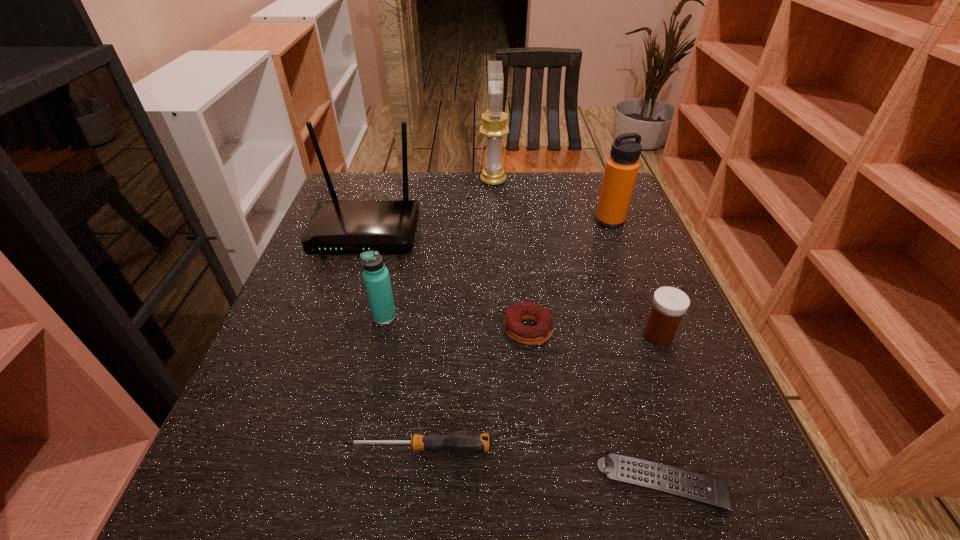
Where is `object located in the far right corner section of the desktop`? This screenshot has height=540, width=960. object located in the far right corner section of the desktop is located at coordinates (621, 169).

In order to click on object situated at the near right corner in this screenshot , I will do `click(692, 486)`.

Locate an element on the screen. This screenshot has height=540, width=960. vacant space at the far edge of the desktop is located at coordinates (516, 211).

Find the location of a particular element. The height and width of the screenshot is (540, 960). vacant point at the near edge is located at coordinates (335, 481).

The image size is (960, 540). In the image, there is a desktop. Find the location of `vacant space at the left edge`. vacant space at the left edge is located at coordinates (295, 376).

In the image, there is a desktop. Where is `vacant space at the right edge`? The height and width of the screenshot is (540, 960). vacant space at the right edge is located at coordinates (628, 344).

Locate an element on the screen. free space at the near left corner of the desktop is located at coordinates (303, 476).

I want to click on vacant region at the far right corner of the desktop, so tap(569, 173).

The image size is (960, 540). I want to click on empty space that is in between the screwdriver and the remote control, so click(540, 467).

Image resolution: width=960 pixels, height=540 pixels. I want to click on free space between the award and the router, so coord(429,207).